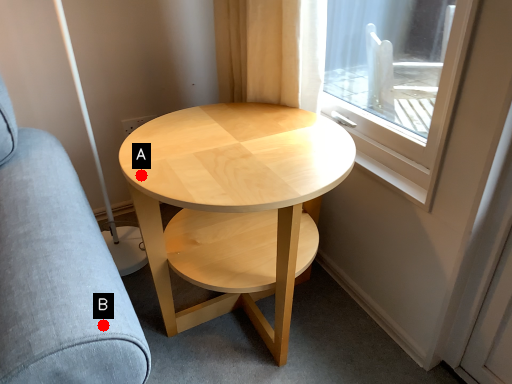
Question: Two points are circled on the image, labeled by A and B beside each circle. Which point is farther from the camera taking this photo?

Choices:
 (A) A is further
 (B) B is further

Answer: (A)